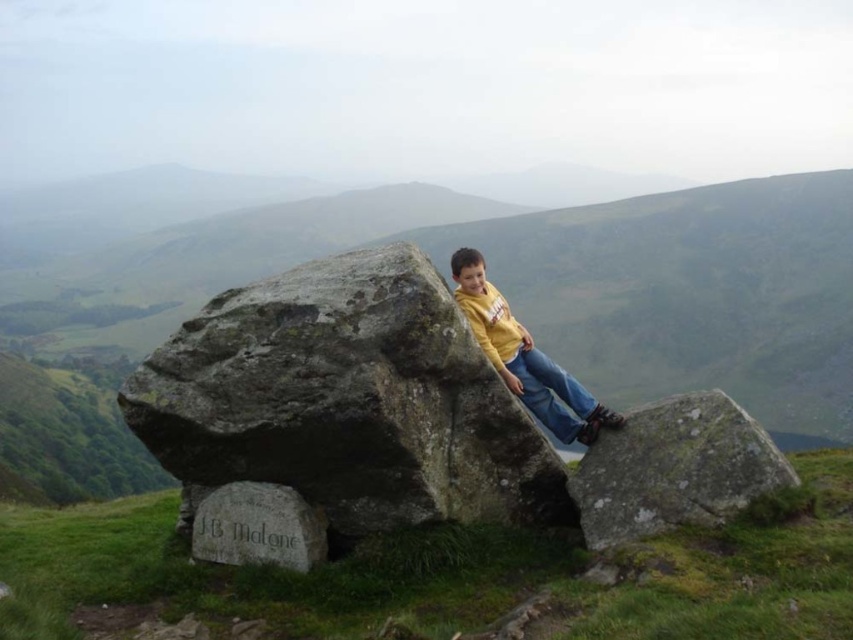
Is green mossy rock at center taller than gray stone at lower center?

Yes, green mossy rock at center is taller than gray stone at lower center.

Does point (553, 291) lie in front of point (204, 550)?

No, (553, 291) is further to viewer.

The height and width of the screenshot is (640, 853). I want to click on green mossy rock at center, so click(x=503, y=292).

Can you confirm if yellow matte shirt at center is shorter than gray stone at lower center?

In fact, yellow matte shirt at center may be taller than gray stone at lower center.

Which is behind, point (500, 337) or point (251, 493)?

The point (500, 337) is more distant.

Is point (531, 346) in front of point (280, 522)?

No, (531, 346) is further to viewer.

Identify the location of yellow matte shirt at center. The height and width of the screenshot is (640, 853). (524, 356).

Does point (734, 253) come behind point (572, 384)?

Yes.

Describe the element at coordinates (503, 292) in the screenshot. The image size is (853, 640). I see `green mossy rock at center` at that location.

The image size is (853, 640). What do you see at coordinates (503, 292) in the screenshot? I see `green mossy rock at center` at bounding box center [503, 292].

Identify the location of green mossy rock at center. This screenshot has height=640, width=853. (503, 292).